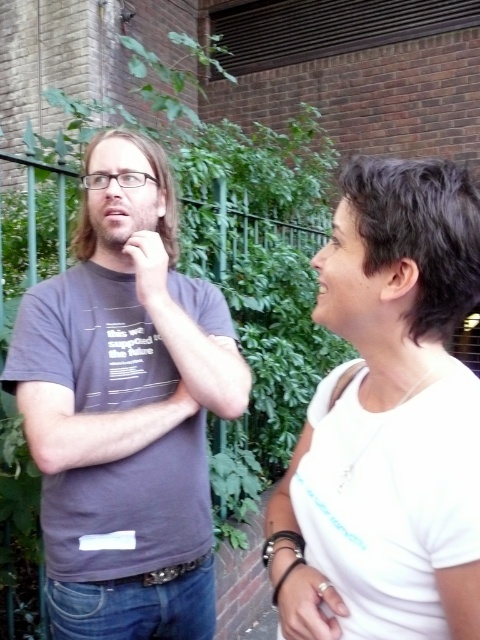
Question: Which object is positioned closest to the matte gray t-shirt at left?

Choices:
 (A) matte skin hand at center
 (B) matte black nose at center
 (C) matte skin nose at center

Answer: (A)

Question: Does matte gray t-shirt at left appear under matte black nose at center?

Choices:
 (A) no
 (B) yes

Answer: (B)

Question: Does white matte ring at center lie in front of matte skin nose at center?

Choices:
 (A) yes
 (B) no

Answer: (A)

Question: Does white matte shirt at center come behind matte black nose at center?

Choices:
 (A) yes
 (B) no

Answer: (B)

Question: Which point appears farthest from the camera in this image?

Choices:
 (A) (327, 637)
 (B) (144, 257)
 (C) (120, 200)
 (D) (120, 340)

Answer: (C)

Question: Which of the following is the closest to the observer?

Choices:
 (A) white matte ring at center
 (B) matte skin nose at center
 (C) matte gray t-shirt at left
 (D) matte black nose at center

Answer: (A)